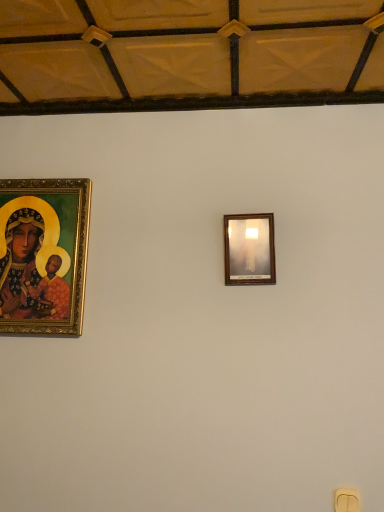
The width and height of the screenshot is (384, 512). What do you see at coordinates (347, 500) in the screenshot?
I see `yellow plastic light switch at lower right` at bounding box center [347, 500].

What is the approximate width of yellow plastic light switch at lower right?

yellow plastic light switch at lower right is 2.38 centimeters wide.

Find the location of a particular element. gold-framed painting at left is located at coordinates click(32, 268).

Does wooden picture frame at upper center have a greater height compared to gold-framed painting at left?

No.

How much distance is there between wooden picture frame at upper center and gold-framed painting at left?

A distance of 28.92 inches exists between wooden picture frame at upper center and gold-framed painting at left.

Is wooden picture frame at upper center beside gold-framed painting at left?

No, wooden picture frame at upper center is not next to gold-framed painting at left.

Which is closer, (270,259) or (23,271)?

Clearly, point (270,259) is closer to the camera than point (23,271).

Does gold-framed painting at left contain wooden picture frame at upper center?

Actually, wooden picture frame at upper center is outside gold-framed painting at left.

Measure the distance between gold-framed painting at left and wooden picture frame at upper center.

gold-framed painting at left and wooden picture frame at upper center are 28.92 inches apart.

Is gold-framed painting at left in contact with wooden picture frame at upper center?

No, gold-framed painting at left is not with wooden picture frame at upper center.

Is gold-framed painting at left further to the viewer compared to wooden picture frame at upper center?

Yes, gold-framed painting at left is further from the camera.

From a real-world perspective, is wooden picture frame at upper center over yellow plastic light switch at lower right?

Yes.

Is wooden picture frame at upper center positioned with its back to yellow plastic light switch at lower right?

No, wooden picture frame at upper center is not facing the opposite direction of yellow plastic light switch at lower right.

Is wooden picture frame at upper center shorter than yellow plastic light switch at lower right?

No.

Between wooden picture frame at upper center and yellow plastic light switch at lower right, which one has larger size?

wooden picture frame at upper center.

Considering the relative positions of yellow plastic light switch at lower right and wooden picture frame at upper center in the image provided, is yellow plastic light switch at lower right to the left or to the right of wooden picture frame at upper center?

yellow plastic light switch at lower right is to the right of wooden picture frame at upper center.

Can you tell me how much yellow plastic light switch at lower right and wooden picture frame at upper center differ in facing direction?

The angle between the facing direction of yellow plastic light switch at lower right and the facing direction of wooden picture frame at upper center is 1.97 degrees.

Can wooden picture frame at upper center be found inside yellow plastic light switch at lower right?

No, wooden picture frame at upper center is not surrounded by yellow plastic light switch at lower right.

In terms of height, does yellow plastic light switch at lower right look taller or shorter compared to wooden picture frame at upper center?

Considering their sizes, yellow plastic light switch at lower right has less height than wooden picture frame at upper center.

Image resolution: width=384 pixels, height=512 pixels. I want to click on light switch below the gold-framed painting at left (from a real-world perspective), so click(347, 500).

Would you say gold-framed painting at left is a long distance from yellow plastic light switch at lower right?

Yes.

Is point (21, 250) farther from camera compared to point (346, 498)?

Yes, it is behind point (346, 498).

Does yellow plastic light switch at lower right contain gold-framed painting at left?

No, gold-framed painting at left is located outside of yellow plastic light switch at lower right.

Based on the photo, how different are the orientations of yellow plastic light switch at lower right and gold-framed painting at left in degrees?

yellow plastic light switch at lower right and gold-framed painting at left are facing 1.41 degrees away from each other.

Where is `light switch below the gold-framed painting at left (from the image's perspective)`? This screenshot has width=384, height=512. light switch below the gold-framed painting at left (from the image's perspective) is located at coordinates (347, 500).

Is yellow plastic light switch at lower right shorter than gold-framed painting at left?

Indeed, yellow plastic light switch at lower right has a lesser height compared to gold-framed painting at left.

You are a GUI agent. You are given a task and a screenshot of the screen. Output one action in this format:
    pyautogui.click(x=<x>, y=<y>)
    Task: Click on the picture frame positioned vertically above the gold-framed painting at left (from a real-world perspective)
    This screenshot has height=512, width=384.
    Given the screenshot: What is the action you would take?
    (x=249, y=249)

At what (x,y) coordinates should I click in order to perform the action: click on person that is behind the wooden picture frame at upper center. Please return your answer as a coordinate pair (x, y). Looking at the image, I should click on (32, 268).

Estimate the real-world distances between objects in this image. Which object is further from wooden picture frame at upper center, yellow plastic light switch at lower right or gold-framed painting at left?

yellow plastic light switch at lower right.

Which object lies further to the anchor point wooden picture frame at upper center, gold-framed painting at left or yellow plastic light switch at lower right?

yellow plastic light switch at lower right.

When comparing their distances from yellow plastic light switch at lower right, does wooden picture frame at upper center or gold-framed painting at left seem further?

Based on the image, gold-framed painting at left appears to be further to yellow plastic light switch at lower right.

From the image, which object appears to be nearer to yellow plastic light switch at lower right, gold-framed painting at left or wooden picture frame at upper center?

Based on the image, wooden picture frame at upper center appears to be nearer to yellow plastic light switch at lower right.

From the image, which object appears to be nearer to gold-framed painting at left, yellow plastic light switch at lower right or wooden picture frame at upper center?

The object closer to gold-framed painting at left is wooden picture frame at upper center.

When comparing their distances from gold-framed painting at left, does wooden picture frame at upper center or yellow plastic light switch at lower right seem closer?

Based on the image, wooden picture frame at upper center appears to be nearer to gold-framed painting at left.

You are a GUI agent. You are given a task and a screenshot of the screen. Output one action in this format:
    pyautogui.click(x=<x>, y=<y>)
    Task: Click on the picture frame between gold-framed painting at left and yellow plastic light switch at lower right in the horizontal direction
    
    Given the screenshot: What is the action you would take?
    pyautogui.click(x=249, y=249)